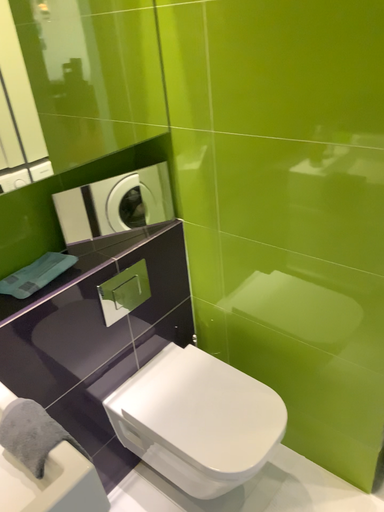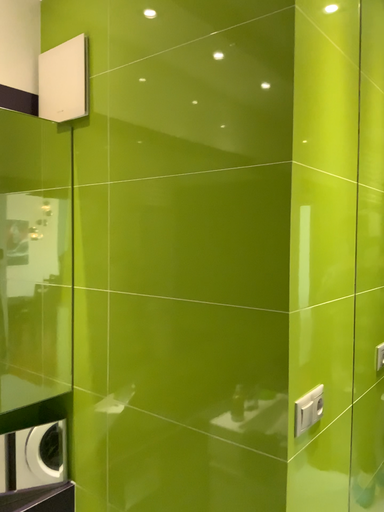
Question: Which way did the camera rotate in the video?

Choices:
 (A) rotated downward
 (B) rotated upward

Answer: (B)